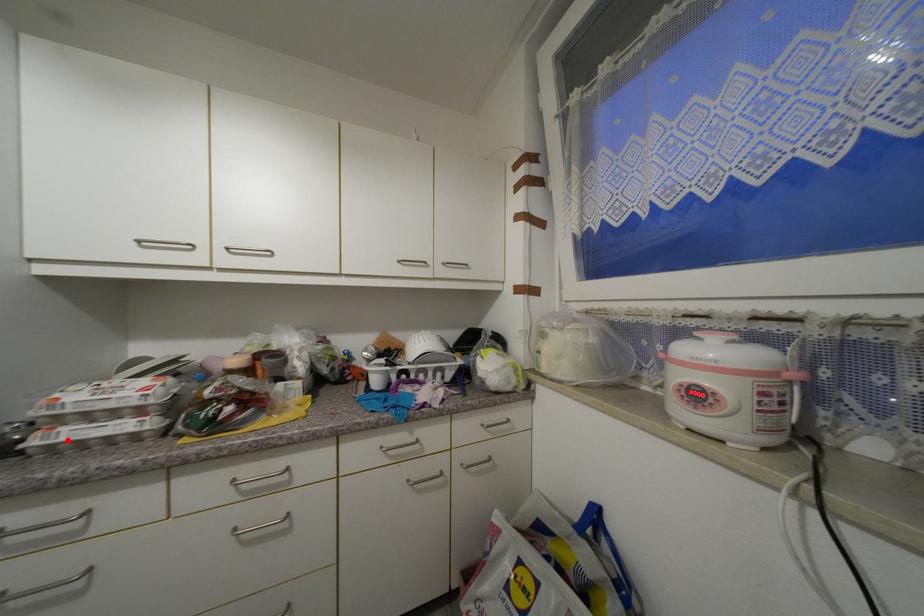
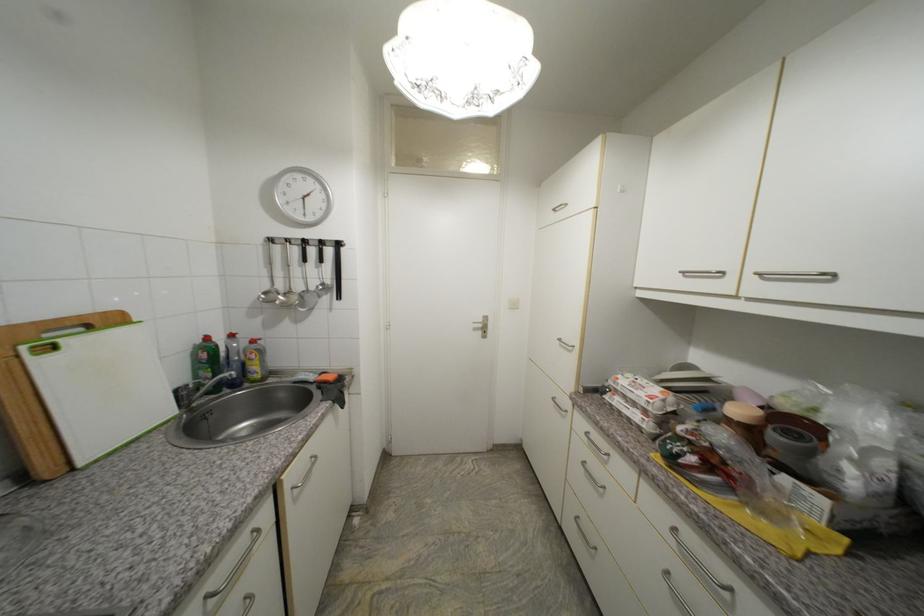
Locate, in the second image, the point that corresponds to the highlighted location in the first image.

(619, 405)